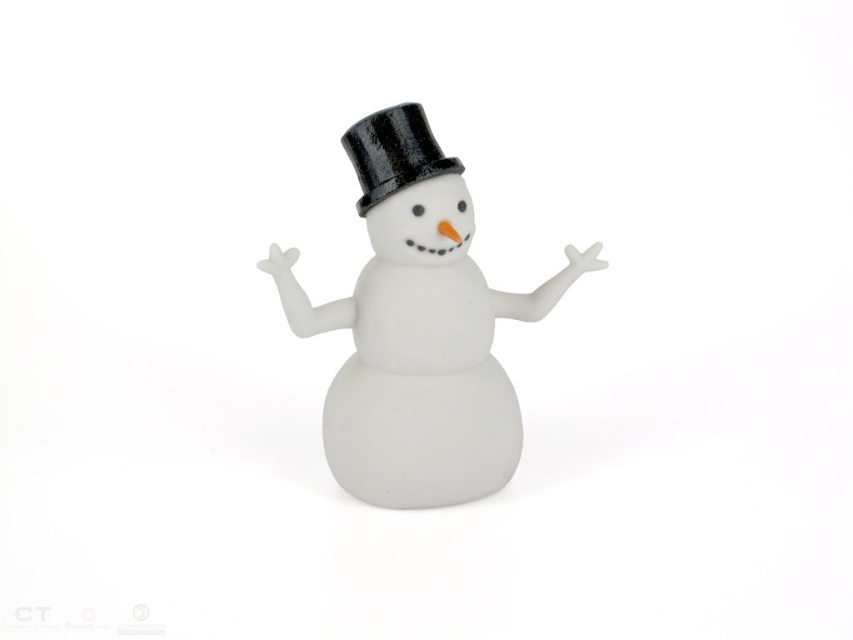
Is satin white snowman at center smaller than black glossy dress hat at center?

No.

You are a GUI agent. You are given a task and a screenshot of the screen. Output one action in this format:
    pyautogui.click(x=<x>, y=<y>)
    Task: Click on the satin white snowman at center
    This screenshot has width=853, height=640.
    Given the screenshot: What is the action you would take?
    pyautogui.click(x=418, y=330)